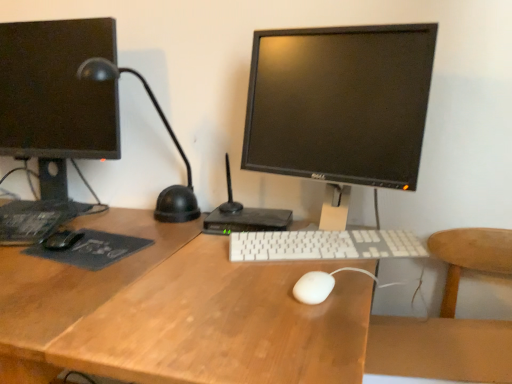
Locate an element on the screen. The width and height of the screenshot is (512, 384). vacant space positioned to the left of black matte mouse at left, marked as the first mouse in a back-to-front arrangement is located at coordinates (17, 241).